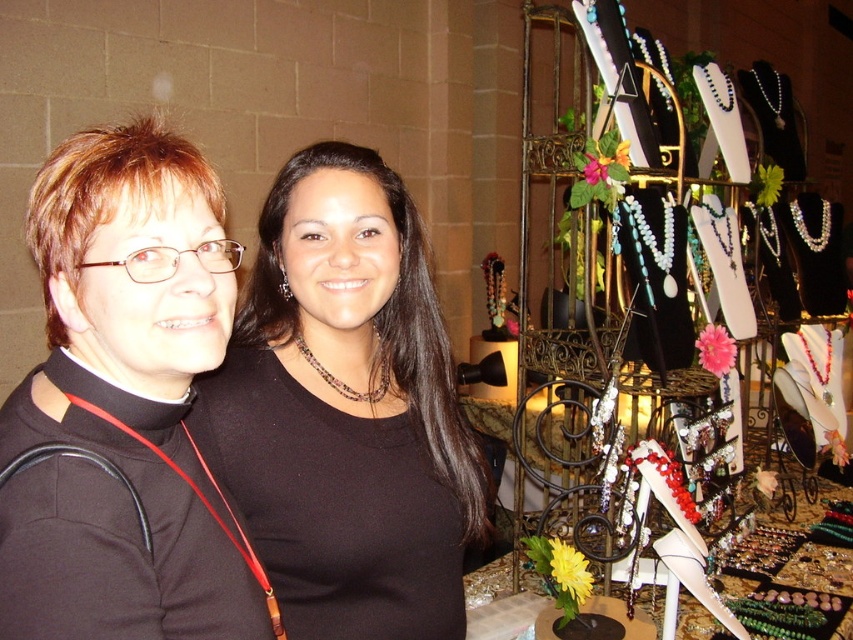
Question: Does matte black necklace at center have a larger size compared to black matte/black turtleneck at center?

Choices:
 (A) yes
 (B) no

Answer: (A)

Question: Which of the following is the closest to the observer?

Choices:
 (A) black matte/black turtleneck at center
 (B) matte black necklace at center

Answer: (A)

Question: Does matte black necklace at center lie behind black matte/black turtleneck at center?

Choices:
 (A) no
 (B) yes

Answer: (B)

Question: Which point appears farthest from the camera in this image?

Choices:
 (A) (154, 362)
 (B) (334, 336)

Answer: (B)

Question: Is matte black necklace at center positioned in front of black matte/black turtleneck at center?

Choices:
 (A) no
 (B) yes

Answer: (A)